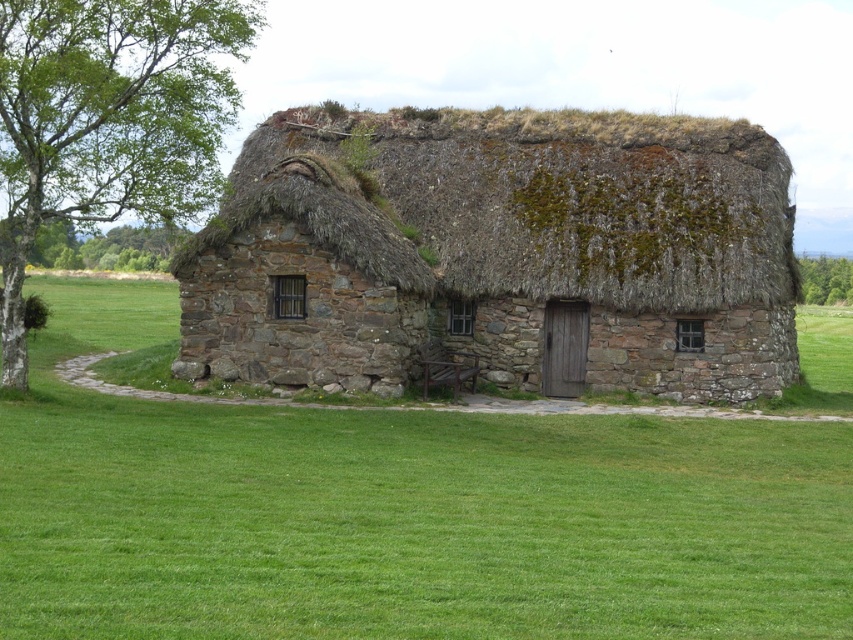
Measure the distance from green leafy tree at upper left to green leafy tree at upper right.

green leafy tree at upper left and green leafy tree at upper right are 36.45 meters apart from each other.

Which is more to the left, green leafy tree at upper left or green leafy tree at upper right?

green leafy tree at upper left is more to the left.

Describe the element at coordinates (107, 246) in the screenshot. I see `green leafy tree at upper left` at that location.

You are a GUI agent. You are given a task and a screenshot of the screen. Output one action in this format:
    pyautogui.click(x=<x>, y=<y>)
    Task: Click on the green leafy tree at upper left
    The image size is (853, 640).
    Given the screenshot: What is the action you would take?
    pyautogui.click(x=107, y=246)

Which is more to the right, green leafy tree at left or green leafy tree at upper left?

From the viewer's perspective, green leafy tree at left appears more on the right side.

Describe the element at coordinates (107, 120) in the screenshot. I see `green leafy tree at left` at that location.

The width and height of the screenshot is (853, 640). Describe the element at coordinates (107, 120) in the screenshot. I see `green leafy tree at left` at that location.

Identify the location of green leafy tree at left. (107, 120).

Who is positioned more to the left, rustic stone hut at center or green leafy tree at upper left?

green leafy tree at upper left is more to the left.

Does point (718, 248) lie behind point (138, 237)?

That is False.

Is point (663, 132) behind point (78, 264)?

No, it is not.

You are a GUI agent. You are given a task and a screenshot of the screen. Output one action in this format:
    pyautogui.click(x=<x>, y=<y>)
    Task: Click on the rustic stone hut at center
    Image resolution: width=853 pixels, height=640 pixels.
    Given the screenshot: What is the action you would take?
    pyautogui.click(x=502, y=253)